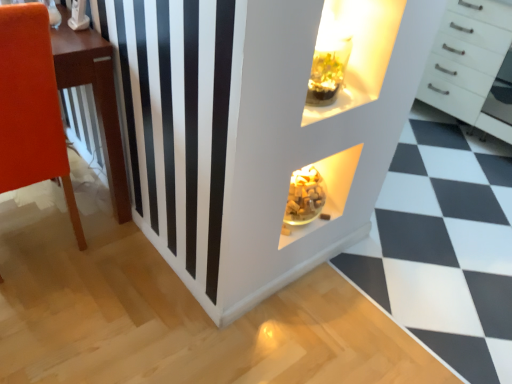
Image resolution: width=512 pixels, height=384 pixels. Describe the element at coordinates (470, 65) in the screenshot. I see `white glossy chest of drawers at upper right` at that location.

Find the location of a particular element. matte orange chair at left is located at coordinates (31, 107).

Describe the element at coordinates (259, 132) in the screenshot. I see `white glossy dresser at center` at that location.

Locate an element on the screen. white glossy chest of drawers at upper right is located at coordinates point(470,65).

Which of these two, white glossy chest of drawers at upper right or matte orange chair at left, stands taller?

Standing taller between the two is matte orange chair at left.

Is white glossy chest of drawers at upper right with matte orange chair at left?

No, white glossy chest of drawers at upper right is not making contact with matte orange chair at left.

Is matte orange chair at left at the back of white glossy chest of drawers at upper right?

white glossy chest of drawers at upper right is not turned away from matte orange chair at left.

Based on the photo, considering their positions, is white glossy chest of drawers at upper right located in front of or behind matte orange chair at left?

Clearly, white glossy chest of drawers at upper right is behind matte orange chair at left.

Looking at this image, is white glossy dresser at center oriented towards white glossy chest of drawers at upper right?

No, white glossy dresser at center is not aimed at white glossy chest of drawers at upper right.

From a real-world perspective, which object stands above the other?

From a 3D spatial view, white glossy chest of drawers at upper right is above.

Which object is further away from the camera, white glossy dresser at center or white glossy chest of drawers at upper right?

Positioned behind is white glossy chest of drawers at upper right.

Considering the relative sizes of white glossy dresser at center and white glossy chest of drawers at upper right in the image provided, is white glossy dresser at center shorter than white glossy chest of drawers at upper right?

Indeed, white glossy dresser at center has a lesser height compared to white glossy chest of drawers at upper right.

Between matte orange chair at left and white glossy chest of drawers at upper right, which one has larger size?

white glossy chest of drawers at upper right.

Measure the distance between matte orange chair at left and white glossy chest of drawers at upper right.

The distance of matte orange chair at left from white glossy chest of drawers at upper right is 2.30 meters.

Can you confirm if matte orange chair at left is shorter than white glossy chest of drawers at upper right?

No.

From the image's perspective, is matte orange chair at left under white glossy chest of drawers at upper right?

Indeed, from the image's perspective, matte orange chair at left is shown beneath white glossy chest of drawers at upper right.

Measure the distance between matte orange chair at left and white glossy dresser at center.

matte orange chair at left and white glossy dresser at center are 22.30 inches apart from each other.

Considering the points (67, 187) and (399, 115), which point is behind, point (67, 187) or point (399, 115)?

The point (67, 187) is farther.

Is white glossy dresser at center at the back of matte orange chair at left?

No, matte orange chair at left's orientation is not away from white glossy dresser at center.

Image resolution: width=512 pixels, height=384 pixels. There is a white glossy dresser at center. Identify the location of furniture above it (from a real-world perspective). (31, 107).

From the picture: Is white glossy dresser at center positioned in front of matte orange chair at left?

Yes.

Which object is wider, white glossy dresser at center or matte orange chair at left?

Wider between the two is white glossy dresser at center.

Is white glossy dresser at center aimed at matte orange chair at left?

No, white glossy dresser at center is not oriented towards matte orange chair at left.

Is white glossy dresser at center a part of white glossy chest of drawers at upper right?

Definitely not — white glossy dresser at center is not inside white glossy chest of drawers at upper right.

Which object is closer to the camera, white glossy chest of drawers at upper right or white glossy dresser at center?

white glossy dresser at center is closer to the camera.

Is white glossy dresser at center at the back of white glossy chest of drawers at upper right?

white glossy chest of drawers at upper right is not turned away from white glossy dresser at center.

Where is `chest of drawers located on the right of matte orange chair at left`? The width and height of the screenshot is (512, 384). chest of drawers located on the right of matte orange chair at left is located at coordinates (470, 65).

This screenshot has height=384, width=512. I want to click on dresser in front of the white glossy chest of drawers at upper right, so click(x=259, y=132).

Based on their spatial positions, is white glossy chest of drawers at upper right or matte orange chair at left further from white glossy dresser at center?

white glossy chest of drawers at upper right lies further to white glossy dresser at center than the other object.

Which object lies nearer to the anchor point white glossy dresser at center, matte orange chair at left or white glossy chest of drawers at upper right?

matte orange chair at left lies closer to white glossy dresser at center than the other object.

Estimate the real-world distances between objects in this image. Which object is further from white glossy chest of drawers at upper right, white glossy dresser at center or matte orange chair at left?

matte orange chair at left is further to white glossy chest of drawers at upper right.

Estimate the real-world distances between objects in this image. Which object is closer to white glossy chest of drawers at upper right, matte orange chair at left or white glossy dresser at center?

white glossy dresser at center lies closer to white glossy chest of drawers at upper right than the other object.

Based on their spatial positions, is white glossy chest of drawers at upper right or white glossy dresser at center further from matte orange chair at left?

The object further to matte orange chair at left is white glossy chest of drawers at upper right.

When comparing their distances from matte orange chair at left, does white glossy dresser at center or white glossy chest of drawers at upper right seem closer?

Among the two, white glossy dresser at center is located nearer to matte orange chair at left.

In order to click on dresser between matte orange chair at left and white glossy chest of drawers at upper right in this screenshot , I will do `click(259, 132)`.